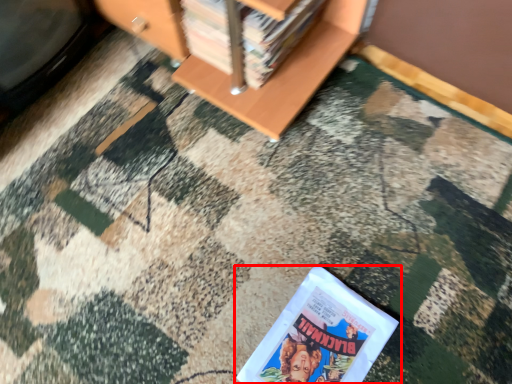
Question: From the image's perspective, what is the correct spatial relationship of book (annotated by the red box) in relation to book?

Choices:
 (A) above
 (B) below

Answer: (B)